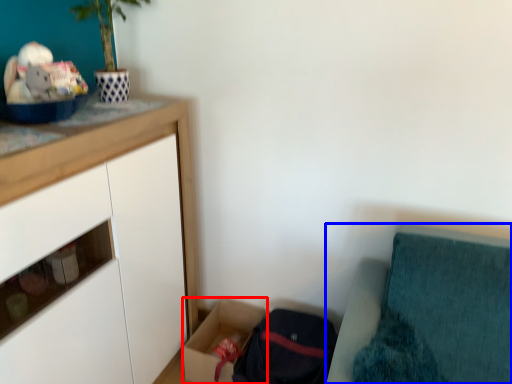
Question: Among these objects, which one is farthest to the camera, storage box (highlighted by a red box) or furniture (highlighted by a blue box)?

Choices:
 (A) storage box
 (B) furniture

Answer: (A)